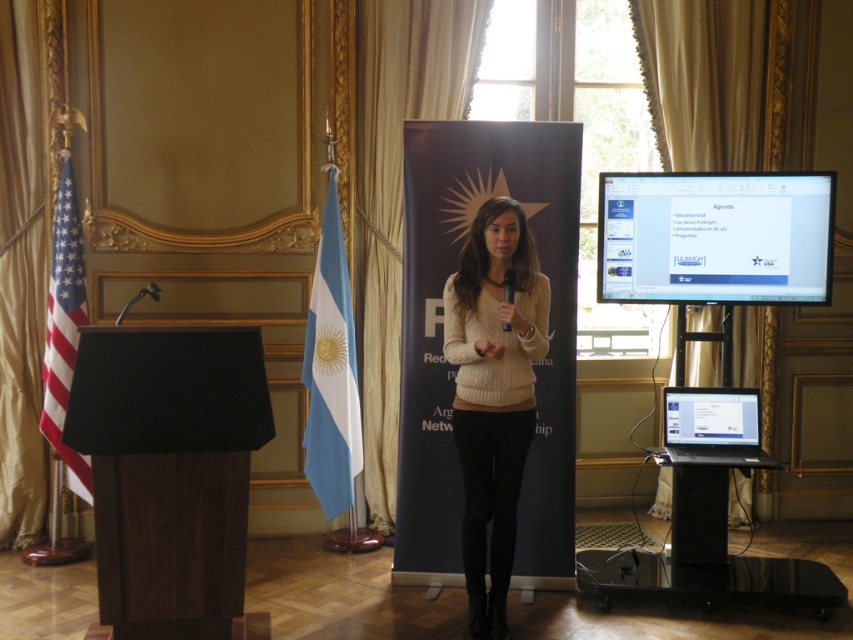
Which is below, knit sweater at center or red-white striped flag at left?

knit sweater at center is below.

Which is behind, point (473, 417) or point (59, 232)?

The point (59, 232) is behind.

Where is `knit sweater at center`? The width and height of the screenshot is (853, 640). knit sweater at center is located at coordinates (492, 394).

Is knit sweater at center positioned before blue fabric flag at center?

Yes, knit sweater at center is in front of blue fabric flag at center.

You are a GUI agent. You are given a task and a screenshot of the screen. Output one action in this format:
    pyautogui.click(x=<x>, y=<y>)
    Task: Click on the knit sweater at center
    The width and height of the screenshot is (853, 640).
    Given the screenshot: What is the action you would take?
    492,394

Looking at this image, which of these two, red-white striped flag at left or black glossy laptop at lower right, stands shorter?

black glossy laptop at lower right

Describe the element at coordinates (64, 330) in the screenshot. I see `red-white striped flag at left` at that location.

Is point (74, 314) farther from camera compared to point (692, 412)?

Yes.

Where is `red-white striped flag at left`? This screenshot has height=640, width=853. red-white striped flag at left is located at coordinates (64, 330).